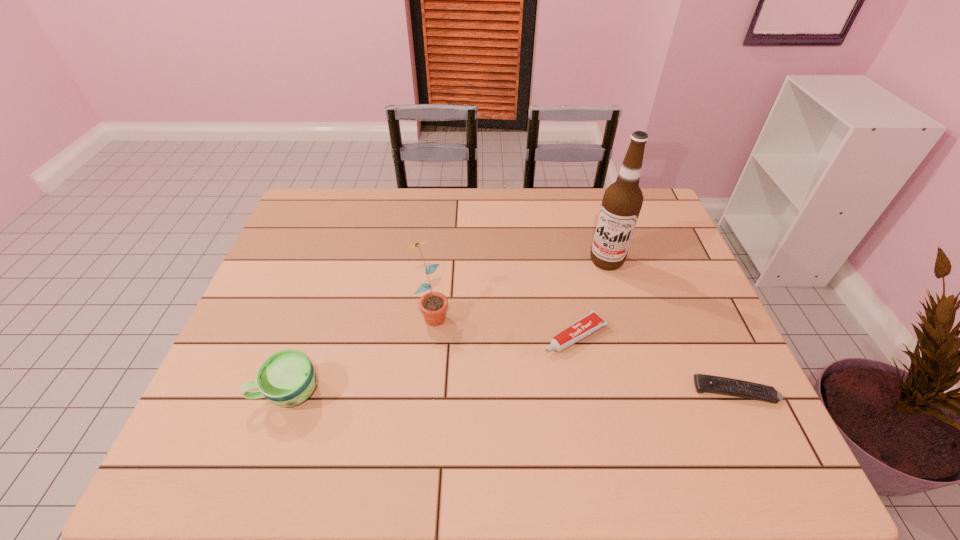
Where is `cup that is at the near edge`? cup that is at the near edge is located at coordinates (287, 378).

This screenshot has height=540, width=960. I want to click on remote control at the near edge, so click(x=704, y=383).

You are a GUI agent. You are given a task and a screenshot of the screen. Output one action in this format:
    pyautogui.click(x=<x>, y=<y>)
    Task: Click on the object that is at the left edge
    Image resolution: width=960 pixels, height=540 pixels.
    Given the screenshot: What is the action you would take?
    pyautogui.click(x=287, y=378)

Locate an element on the screen. The height and width of the screenshot is (540, 960). object located at the right edge is located at coordinates (704, 383).

This screenshot has width=960, height=540. I want to click on object situated at the near left corner, so click(x=287, y=378).

You are a GUI agent. You are given a task and a screenshot of the screen. Output one action in this format:
    pyautogui.click(x=<x>, y=<y>)
    Task: Click on the object that is at the near right corner
    Image resolution: width=960 pixels, height=540 pixels.
    Given the screenshot: What is the action you would take?
    pyautogui.click(x=704, y=383)

In the image, there is a desktop. Identify the location of vacant space at the far edge. The width and height of the screenshot is (960, 540). (464, 228).

Where is `vacant space at the near edge of the desktop`? This screenshot has width=960, height=540. vacant space at the near edge of the desktop is located at coordinates (627, 398).

This screenshot has width=960, height=540. In the image, there is a desktop. What are the coordinates of `vacant space at the left edge` in the screenshot? It's located at (250, 332).

You are a GUI agent. You are given a task and a screenshot of the screen. Output one action in this format:
    pyautogui.click(x=<x>, y=<y>)
    Task: Click on the vacant space at the right edge
    The height and width of the screenshot is (540, 960).
    Given the screenshot: What is the action you would take?
    pyautogui.click(x=669, y=322)